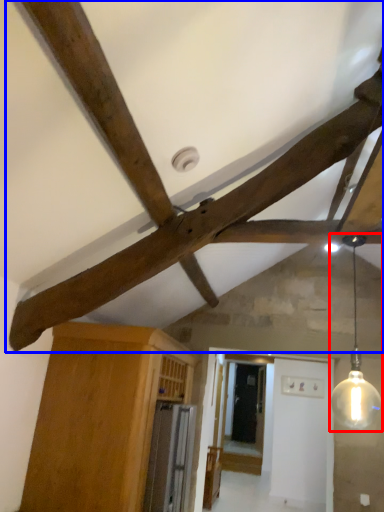
Question: Which object appears closest to the camera in this image, light fixture (highlighted by a red box) or fan (highlighted by a blue box)?

Choices:
 (A) light fixture
 (B) fan

Answer: (A)